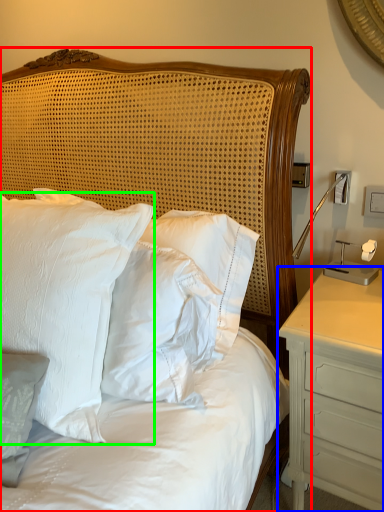
Question: Estimate the real-world distances between objects in this image. Which object is closer to bed (highlighted by a red box), nightstand (highlighted by a blue box) or pillow (highlighted by a green box)?

Choices:
 (A) nightstand
 (B) pillow

Answer: (B)